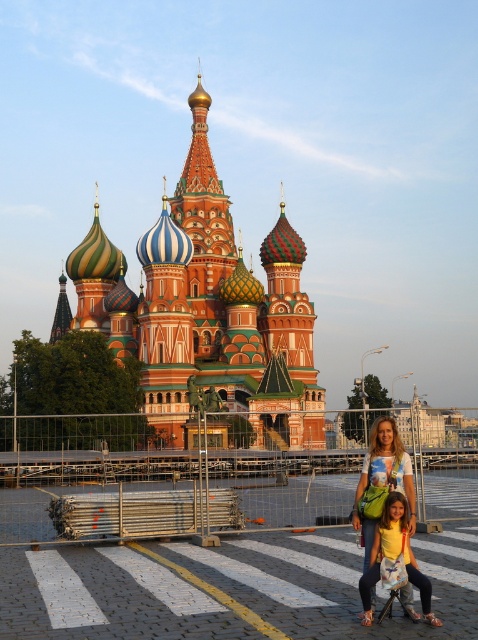
Does matte white t-shirt at center appear on the right side of yellow matte shirt at lower center?

In fact, matte white t-shirt at center is to the left of yellow matte shirt at lower center.

Who is more distant from viewer, [412,483] or [393,532]?

Point [412,483]

Is point (411, 476) farther from camera compared to point (399, 522)?

Yes.

This screenshot has height=640, width=478. I want to click on matte white t-shirt at center, so click(382, 477).

Does point (156, 308) come closer to viewer compared to point (403, 449)?

That is False.

Who is more distant from viewer, (209,220) or (369,552)?

The point (209,220) is behind.

Locate an element on the screen. The image size is (478, 640). multicolored mosaic church at center is located at coordinates (206, 307).

This screenshot has height=640, width=478. What do you see at coordinates (206, 307) in the screenshot? I see `multicolored mosaic church at center` at bounding box center [206, 307].

Is multicolored mosaic church at center below yellow matte shirt at lower center?

Incorrect, multicolored mosaic church at center is not positioned below yellow matte shirt at lower center.

Identify the location of multicolored mosaic church at center. (206, 307).

Identify the location of multicolored mosaic church at center. The height and width of the screenshot is (640, 478). (206, 307).